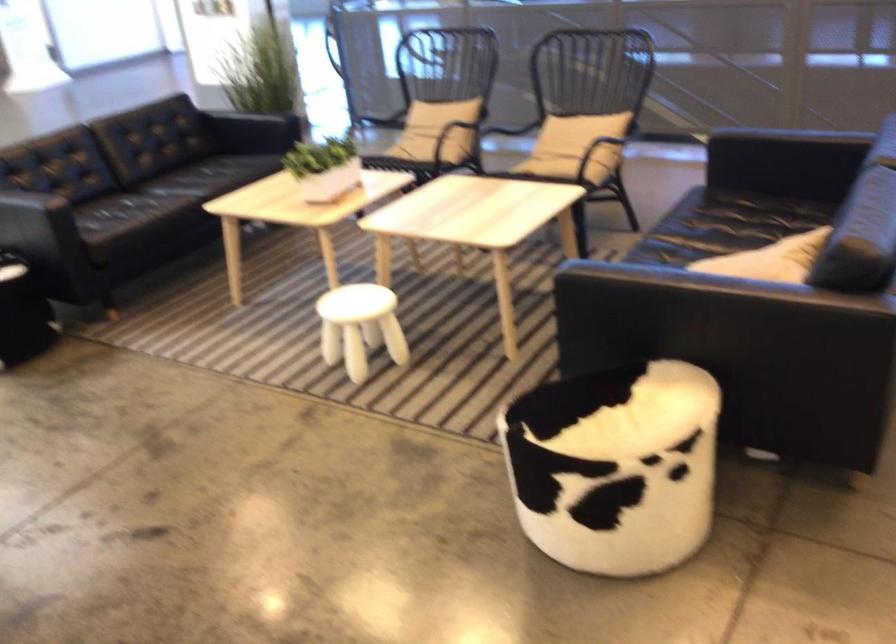
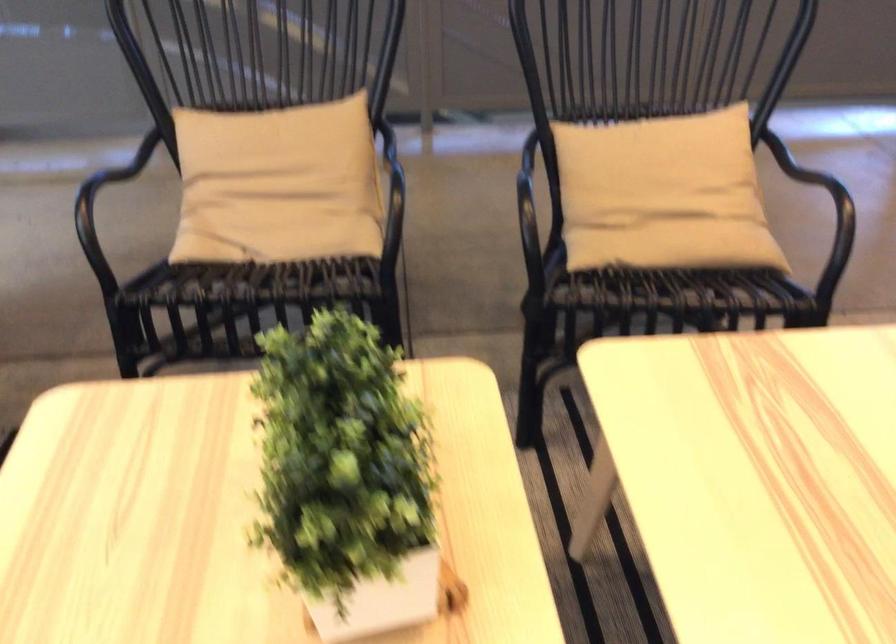
In the second image, find the point that corresponds to point (538, 158) in the first image.

(674, 245)